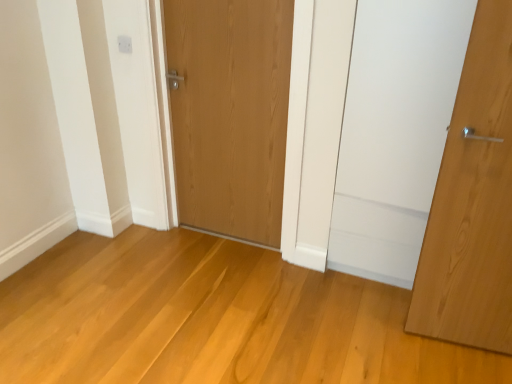
Question: Does natural wood door at right, the 1th door when ordered from right to left, have a larger size compared to wooden door at center, which ranks as the second door in front-to-back order?

Choices:
 (A) yes
 (B) no

Answer: (B)

Question: Does natural wood door at right, which is the 2th door from left to right, appear on the right side of wooden door at center, which is the second door from right to left?

Choices:
 (A) yes
 (B) no

Answer: (A)

Question: From the image's perspective, is natural wood door at right, the second door viewed from the back, on wooden door at center, which is the second door from right to left?

Choices:
 (A) no
 (B) yes

Answer: (A)

Question: From a real-world perspective, is natural wood door at right, which is the 2th door from left to right, over wooden door at center, which ranks as the 1th door in left-to-right order?

Choices:
 (A) yes
 (B) no

Answer: (A)

Question: Is natural wood door at right, positioned as the 1th door in front-to-back order, positioned beyond the bounds of wooden door at center, which ranks as the second door in front-to-back order?

Choices:
 (A) no
 (B) yes

Answer: (B)

Question: Considering the relative sizes of wooden door at center, which is counted as the first door, starting from the back, and natural wood door at right, positioned as the 1th door in front-to-back order, in the image provided, is wooden door at center, which is counted as the first door, starting from the back, thinner than natural wood door at right, positioned as the 1th door in front-to-back order,?

Choices:
 (A) no
 (B) yes

Answer: (A)

Question: Does wooden door at center, which ranks as the 1th door in left-to-right order, appear on the left side of natural wood door at right, the second door viewed from the back?

Choices:
 (A) no
 (B) yes

Answer: (B)

Question: Does wooden door at center, which is counted as the first door, starting from the back, have a greater height compared to natural wood door at right, the second door viewed from the back?

Choices:
 (A) yes
 (B) no

Answer: (B)

Question: Is wooden door at center, which is the second door from right to left, oriented away from natural wood door at right, the second door viewed from the back?

Choices:
 (A) no
 (B) yes

Answer: (A)

Question: Is wooden door at center, which is counted as the first door, starting from the back, further to the viewer compared to natural wood door at right, the 1th door when ordered from right to left?

Choices:
 (A) no
 (B) yes

Answer: (B)

Question: From a real-world perspective, does wooden door at center, which is the second door from right to left, stand above natural wood door at right, which is the 2th door from left to right?

Choices:
 (A) no
 (B) yes

Answer: (A)

Question: Is natural wood door at right, the 1th door when ordered from right to left, oriented away from white plastic electric outlet at upper center?

Choices:
 (A) yes
 (B) no

Answer: (B)